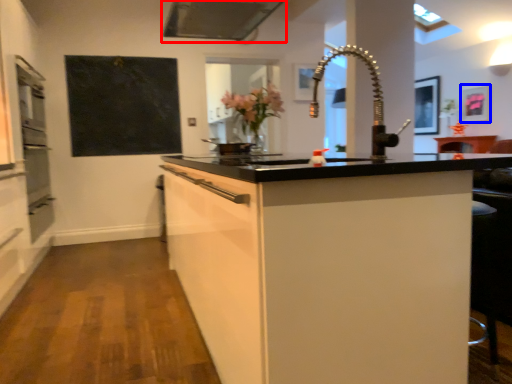
Question: Which point is closer to the camera, exhaust hood (highlighted by a red box) or picture frame (highlighted by a blue box)?

Choices:
 (A) exhaust hood
 (B) picture frame

Answer: (A)